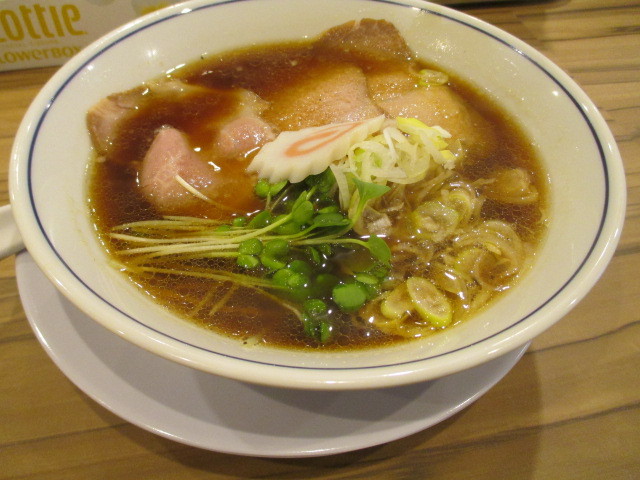
The width and height of the screenshot is (640, 480). In order to click on plate in this screenshot , I will do `click(443, 399)`.